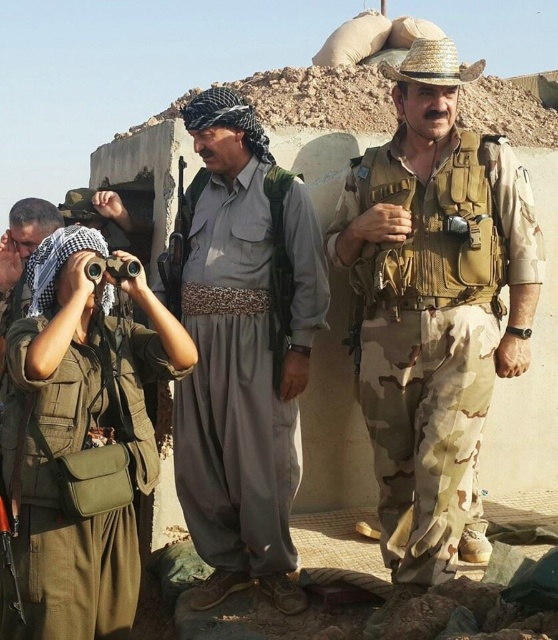
Can you confirm if gray fabric pants at center is thinner than green fabric uniform at left?

No.

Who is more forward, (264,244) or (105,628)?

Point (105,628) is more forward.

Find the location of a particular element. Image resolution: width=558 pixels, height=640 pixels. gray fabric pants at center is located at coordinates (233, 381).

The height and width of the screenshot is (640, 558). I want to click on gray fabric pants at center, so click(233, 381).

Measure the distance between camouflage fabric vest at right and gray fabric pants at center.

They are 16.01 feet apart.

Is camouflage fabric vest at right to the left of gray fabric pants at center from the viewer's perspective?

No, camouflage fabric vest at right is not to the left of gray fabric pants at center.

What do you see at coordinates (434, 332) in the screenshot? This screenshot has width=558, height=640. I see `camouflage fabric vest at right` at bounding box center [434, 332].

Image resolution: width=558 pixels, height=640 pixels. What are the coordinates of `camouflage fabric vest at right` in the screenshot? It's located at (434, 332).

Who is more distant from viewer, (x=463, y=230) or (x=132, y=461)?

Positioned behind is point (x=463, y=230).

Is point (475, 346) more distant than point (112, 534)?

Yes, point (475, 346) is farther from viewer.

Identify the location of camouflage fabric vest at right. (434, 332).